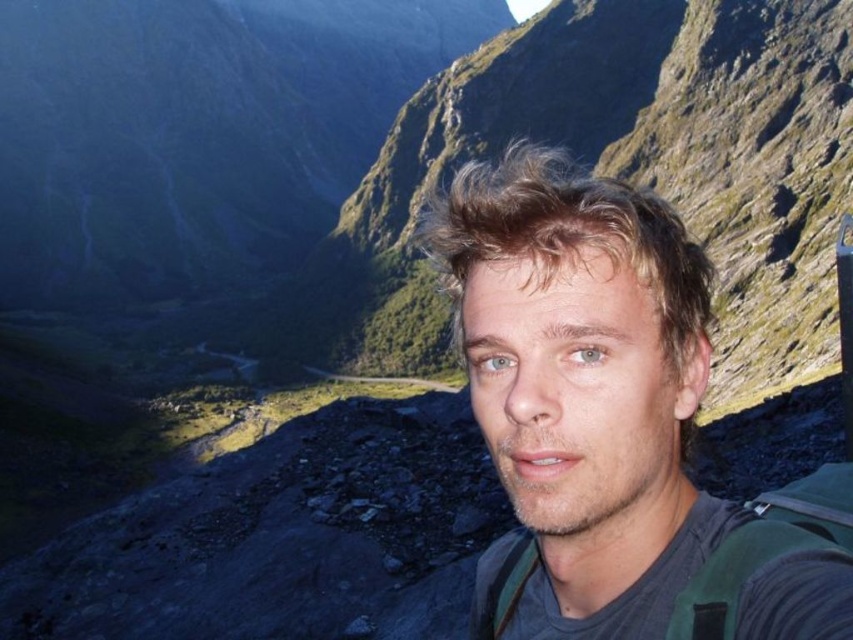
You are a photographer trying to capture the perfect shot of the person in the scene. The person has their blonde hair at center and a green fabric strap at lower right. Based on their positions, which object is closer to the camera?

The blonde hair at center is located above the green fabric strap at lower right, which suggests it is closer to the camera.

You are a photographer trying to capture a clear shot of the person in the scene. Since the person is standing with their back to the mountains, you notice the green fabric backpack at center and the blonde hair at center might be overlapping. Which object is closer to the camera?

The blonde hair at center is in front of the green fabric backpack at center, so it is closer to the camera.